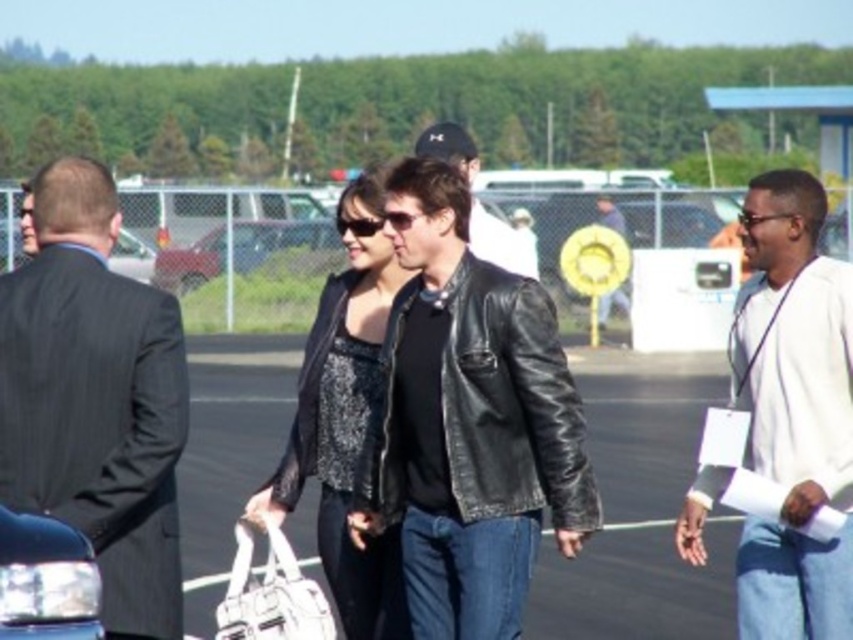
Can you confirm if sparkly black dress at center is positioned to the right of leather jacket at center?

In fact, sparkly black dress at center is to the left of leather jacket at center.

Measure the distance between sparkly black dress at center and camera.

A distance of 6.55 meters exists between sparkly black dress at center and camera.

Locate an element on the screen. The width and height of the screenshot is (853, 640). sparkly black dress at center is located at coordinates (346, 419).

You are a GUI agent. You are given a task and a screenshot of the screen. Output one action in this format:
    pyautogui.click(x=<x>, y=<y>)
    Task: Click on the sparkly black dress at center
    The height and width of the screenshot is (640, 853).
    Given the screenshot: What is the action you would take?
    pyautogui.click(x=346, y=419)

Who is more forward, (804, 429) or (340, 280)?

Point (804, 429) is in front.

Who is positioned more to the right, white cotton shirt at right or sparkly black dress at center?

white cotton shirt at right

Who is more forward, (758, 424) or (357, 326)?

Point (758, 424)

In order to click on white cotton shirt at right in this screenshot , I will do `click(793, 410)`.

Does dark gray pinstripe suit at left have a greater height compared to sparkly black dress at center?

Incorrect, dark gray pinstripe suit at left's height is not larger of sparkly black dress at center's.

Describe the element at coordinates (96, 400) in the screenshot. This screenshot has width=853, height=640. I see `dark gray pinstripe suit at left` at that location.

Describe the element at coordinates (96, 400) in the screenshot. I see `dark gray pinstripe suit at left` at that location.

Identify the location of dark gray pinstripe suit at left. 96,400.